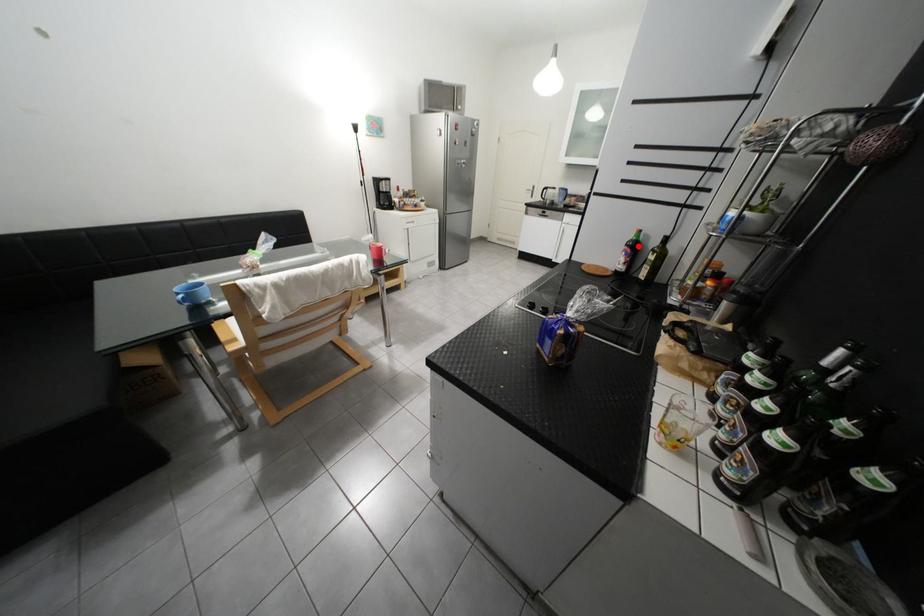
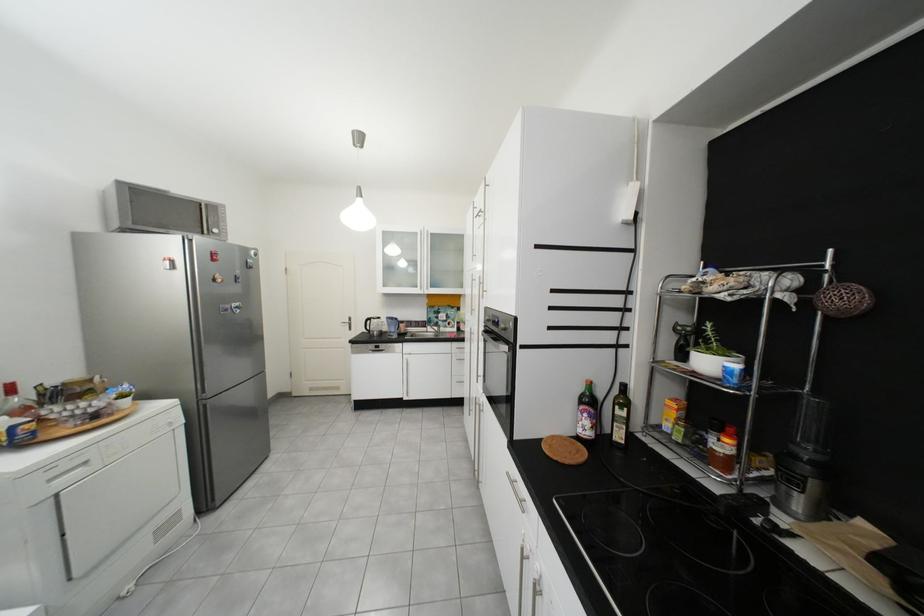
Find the pixel in the second image that matches the highlighted location in the first image.

(592, 403)